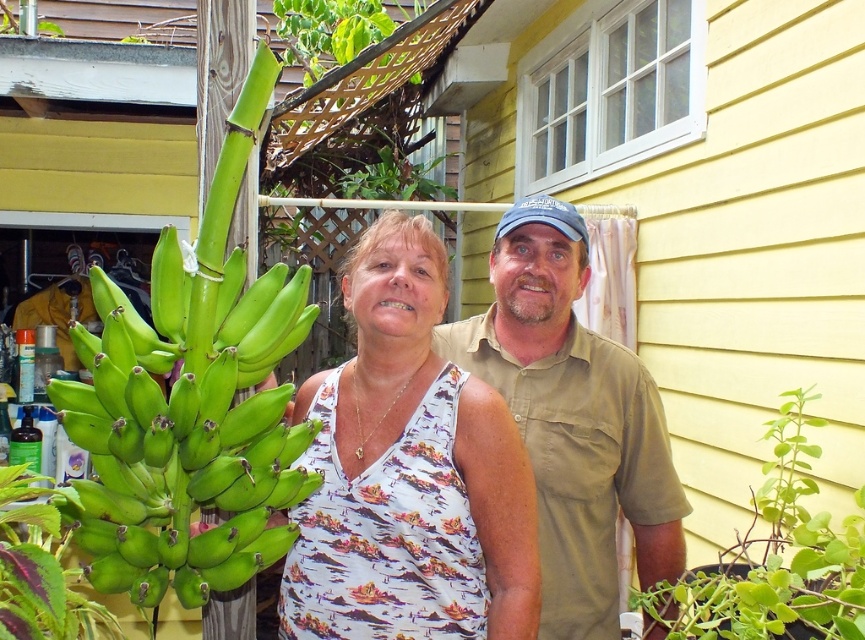
You are standing at the point marked by the coordinate point at point (428, 570). You want to walk to the yellow house with a window and a curtain. Which direction should you go?

You should go west because the yellow house with a window and a curtain is located to the west of the point marked by the coordinate point at point (428, 570).

You are a photographer trying to capture both the white floral tank top at center and the khaki cotton shirt at center in a single frame. Which clothing item should you focus on first to ensure it appears larger in the photo?

The khaki cotton shirt at center is larger than the white floral tank top at center, so you should focus on the khaki cotton shirt at center first to ensure it appears larger in the photo.